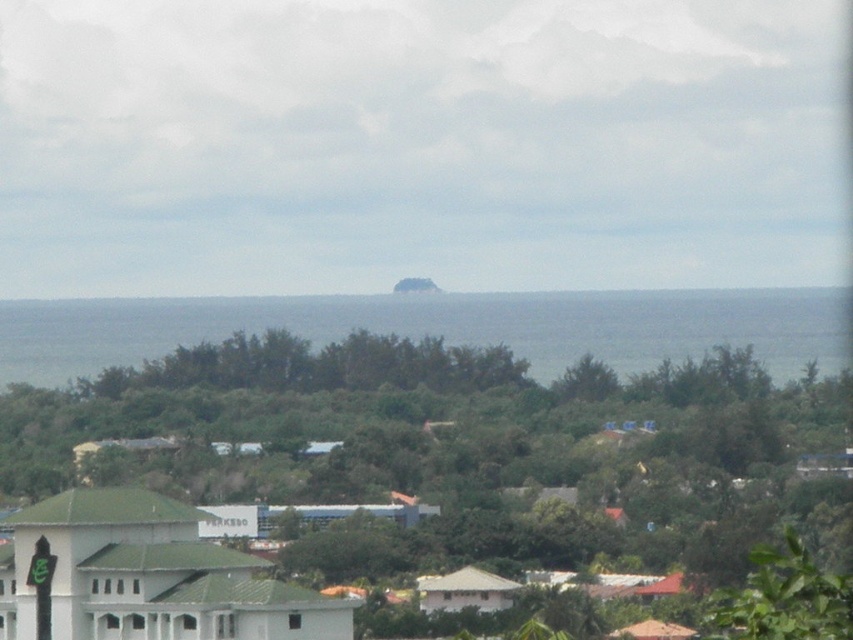
Does point (125, 358) lie in front of point (756, 595)?

No.

Who is lower down, gray/smooth water at center or green leafy tree at lower right?

Positioned lower is green leafy tree at lower right.

Measure the distance between point (750, 342) and camera.

A distance of 637.95 meters exists between point (750, 342) and camera.

You are a GUI agent. You are given a task and a screenshot of the screen. Output one action in this format:
    pyautogui.click(x=<x>, y=<y>)
    Task: Click on the gray/smooth water at center
    
    Given the screenshot: What is the action you would take?
    pyautogui.click(x=440, y=326)

Does point (672, 480) come farther from viewer compared to point (838, 628)?

Yes, point (672, 480) is farther from viewer.

Does point (300, 525) come in front of point (827, 611)?

No.

Where is `green leafy tree at center`? Image resolution: width=853 pixels, height=640 pixels. green leafy tree at center is located at coordinates (450, 451).

Does green leafy tree at center have a greater width compared to gray/smooth water at center?

In fact, green leafy tree at center might be narrower than gray/smooth water at center.

Does green leafy tree at center appear on the left side of gray/smooth water at center?

Yes, green leafy tree at center is to the left of gray/smooth water at center.

Who is more forward, (758, 388) or (517, 312)?

Point (517, 312) is more forward.

The height and width of the screenshot is (640, 853). I want to click on green leafy tree at center, so click(450, 451).